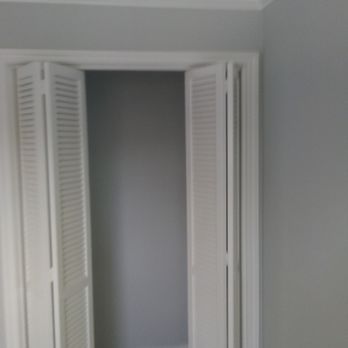
The height and width of the screenshot is (348, 348). In order to click on opening (closet) in this screenshot , I will do `click(148, 284)`.